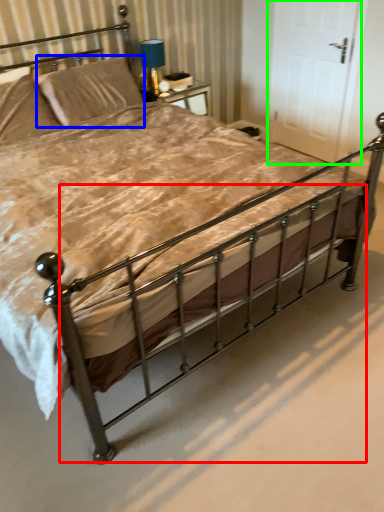
Question: Considering the real-world distances, which object is farthest from balustrade (highlighted by a red box)? pillow (highlighted by a blue box) or door (highlighted by a green box)?

Choices:
 (A) pillow
 (B) door

Answer: (B)